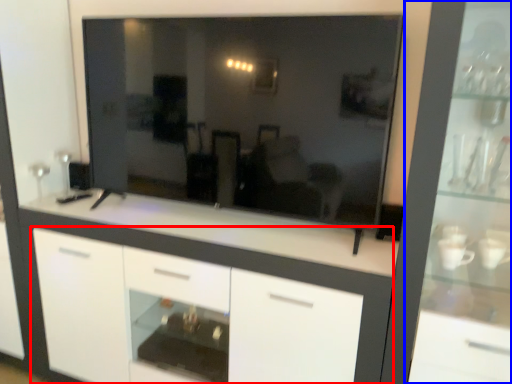
Question: Which object appears closest to the camera in this image, cabinetry (highlighted by a red box) or dresser (highlighted by a blue box)?

Choices:
 (A) cabinetry
 (B) dresser

Answer: (B)